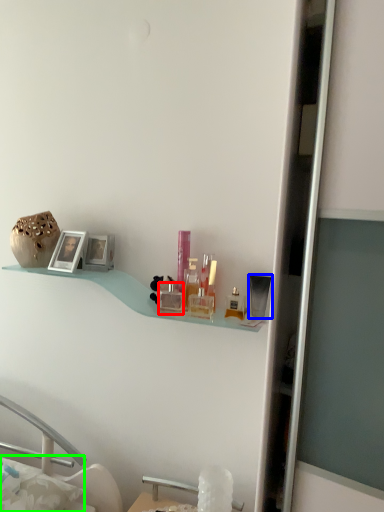
Question: Which object is positioned closest to toiletry (highlighted by a red box)? Select from toiletry (highlighted by a blue box) and pillow (highlighted by a green box).

Choices:
 (A) toiletry
 (B) pillow

Answer: (A)